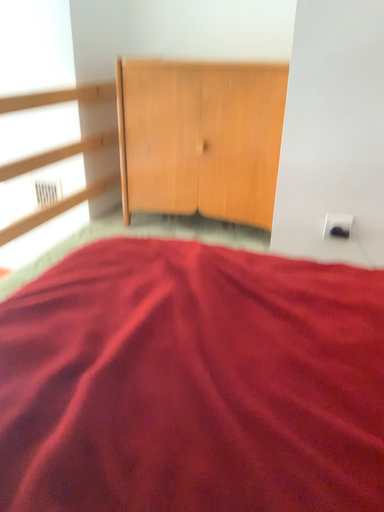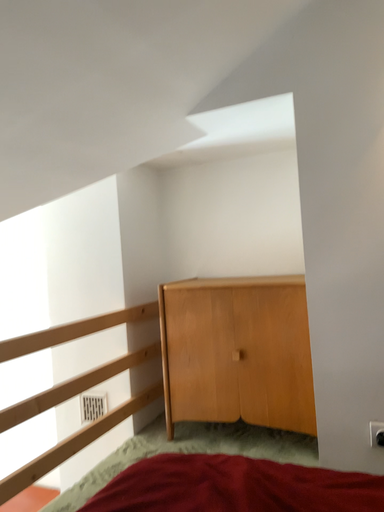
Question: How did the camera likely rotate when shooting the video?

Choices:
 (A) rotated left
 (B) rotated right

Answer: (A)